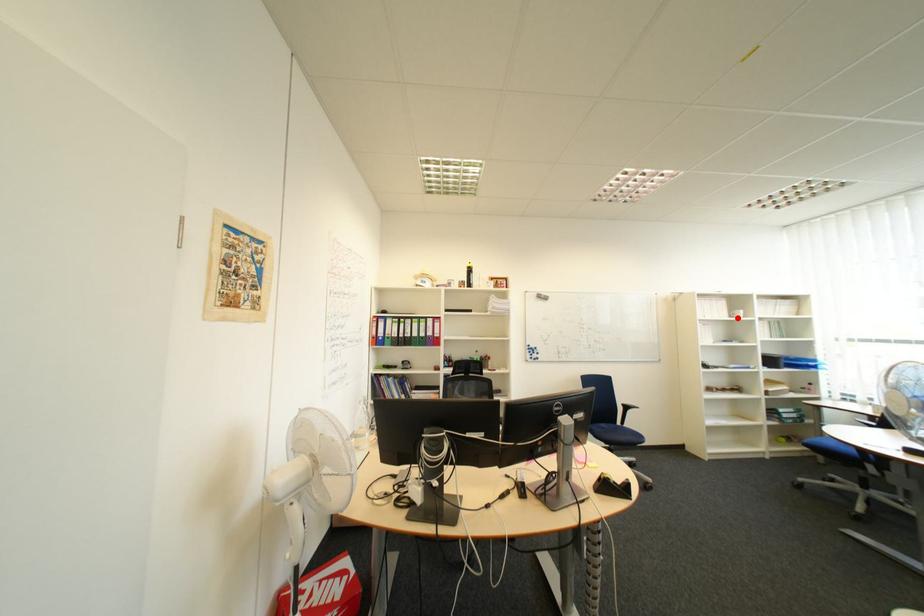
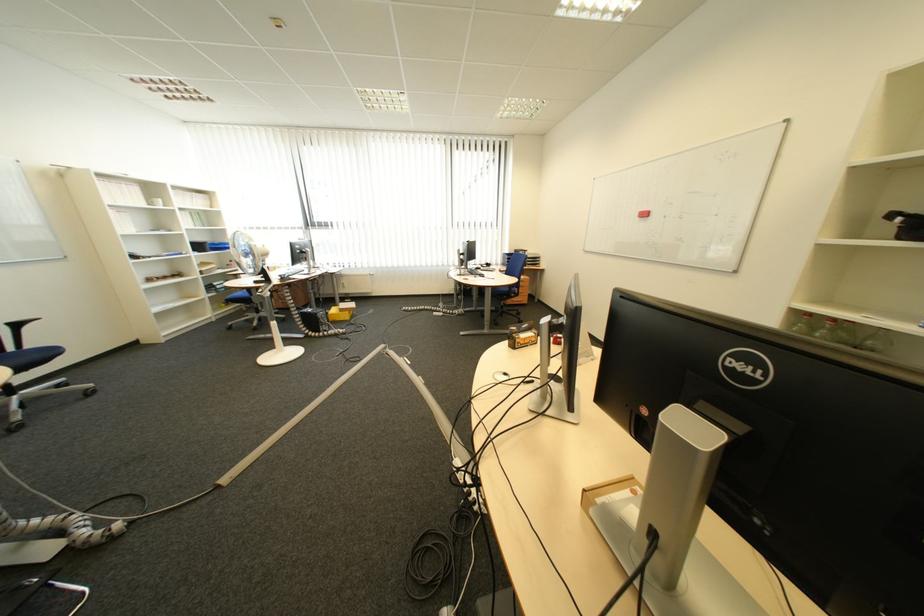
Where in the second image is the point corresponding to the highlighted location from the first image?

(155, 206)